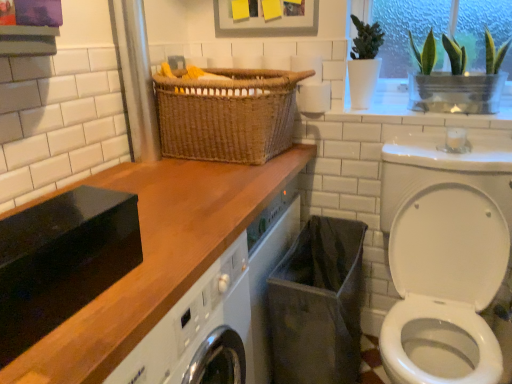
Question: From a real-world perspective, is white matte toilet paper at upper center physically located above or below black fabric laundry basket at lower center?

Choices:
 (A) below
 (B) above

Answer: (B)

Question: From their relative heights in the image, would you say white matte toilet paper at upper center is taller or shorter than black fabric laundry basket at lower center?

Choices:
 (A) tall
 (B) short

Answer: (B)

Question: Which object is positioned farthest from the black fabric laundry basket at lower center?

Choices:
 (A) woven brown basket at center
 (B) green glass vase at upper right
 (C) white matte toilet paper at upper center
 (D) white glossy washer at lower right
 (E) wooden at upper left

Answer: (B)

Question: Which of these objects is positioned closest to the white matte toilet paper at upper center?

Choices:
 (A) white glossy washer at lower right
 (B) woven brown basket at center
 (C) black fabric laundry basket at lower center
 (D) wooden at upper left
 (E) green glass vase at upper right

Answer: (B)